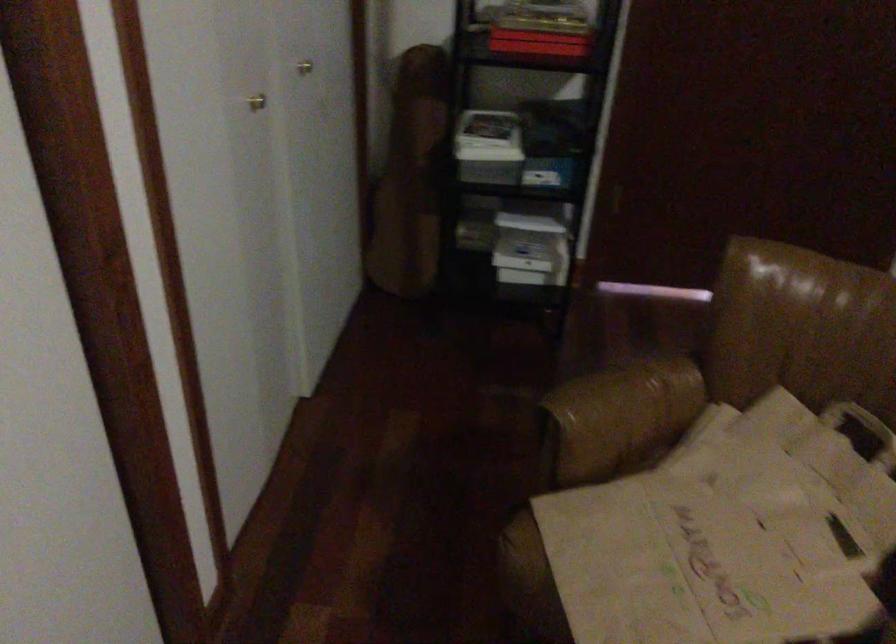
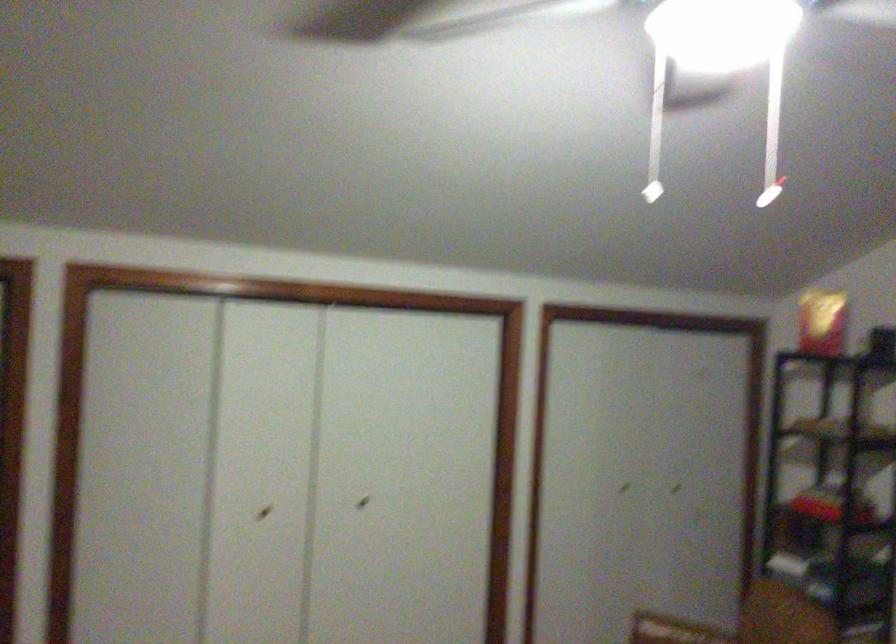
Find the pixel in the second image that matches point 263,86 in the first image.

(623, 488)